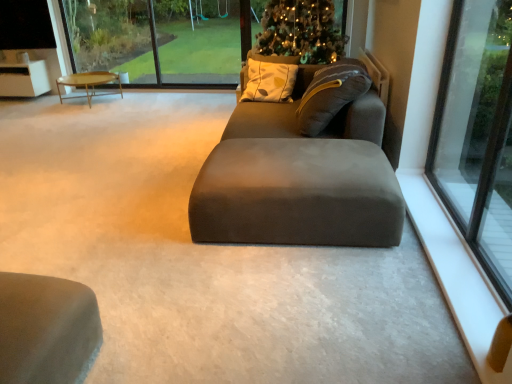
Question: Considering the relative positions of white smooth window sill at lower right and wooden polished coffee table at left in the image provided, is white smooth window sill at lower right to the left of wooden polished coffee table at left from the viewer's perspective?

Choices:
 (A) yes
 (B) no

Answer: (B)

Question: Does white smooth window sill at lower right have a lesser height compared to wooden polished coffee table at left?

Choices:
 (A) no
 (B) yes

Answer: (B)

Question: Is white smooth window sill at lower right at the right side of wooden polished coffee table at left?

Choices:
 (A) yes
 (B) no

Answer: (A)

Question: From a real-world perspective, is white smooth window sill at lower right positioned over wooden polished coffee table at left based on gravity?

Choices:
 (A) yes
 (B) no

Answer: (B)

Question: Is white smooth window sill at lower right bigger than wooden polished coffee table at left?

Choices:
 (A) no
 (B) yes

Answer: (A)

Question: Is green plastic swing set at upper center bigger or smaller than transparent glass window at right?

Choices:
 (A) big
 (B) small

Answer: (A)

Question: In the image, is green plastic swing set at upper center positioned in front of or behind transparent glass window at right?

Choices:
 (A) front
 (B) behind

Answer: (B)

Question: From their relative heights in the image, would you say green plastic swing set at upper center is taller or shorter than transparent glass window at right?

Choices:
 (A) short
 (B) tall

Answer: (A)

Question: Is green plastic swing set at upper center inside or outside of transparent glass window at right?

Choices:
 (A) inside
 (B) outside

Answer: (B)

Question: From their relative heights in the image, would you say transparent glass window at right is taller or shorter than transparent glass window at upper center?

Choices:
 (A) short
 (B) tall

Answer: (B)

Question: Considering their positions, is transparent glass window at right located in front of or behind transparent glass window at upper center?

Choices:
 (A) front
 (B) behind

Answer: (A)

Question: Considering the positions of transparent glass window at right and transparent glass window at upper center in the image, is transparent glass window at right wider or thinner than transparent glass window at upper center?

Choices:
 (A) wide
 (B) thin

Answer: (B)

Question: From a real-world perspective, is transparent glass window at right positioned above or below transparent glass window at upper center?

Choices:
 (A) below
 (B) above

Answer: (B)

Question: From the image's perspective, is suede gray bean bag at center located above or below wooden polished coffee table at left?

Choices:
 (A) above
 (B) below

Answer: (B)

Question: Based on their sizes in the image, would you say suede gray bean bag at center is bigger or smaller than wooden polished coffee table at left?

Choices:
 (A) big
 (B) small

Answer: (A)